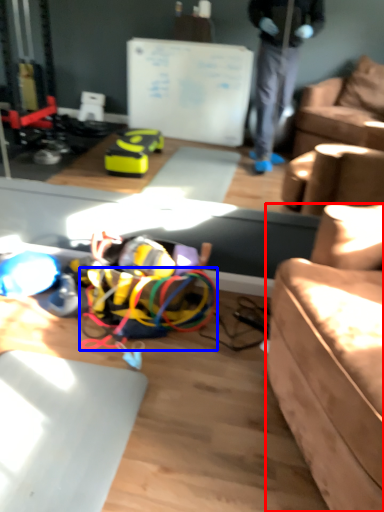
Question: Among these objects, which one is nearest to the camera, studio couch (highlighted by a red box) or wire (highlighted by a blue box)?

Choices:
 (A) studio couch
 (B) wire

Answer: (A)